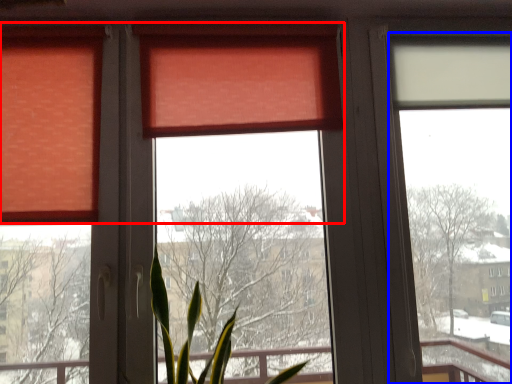
Question: Which object appears farthest to the camera in this image, curtain (highlighted by a red box) or window screen (highlighted by a blue box)?

Choices:
 (A) curtain
 (B) window screen

Answer: (B)